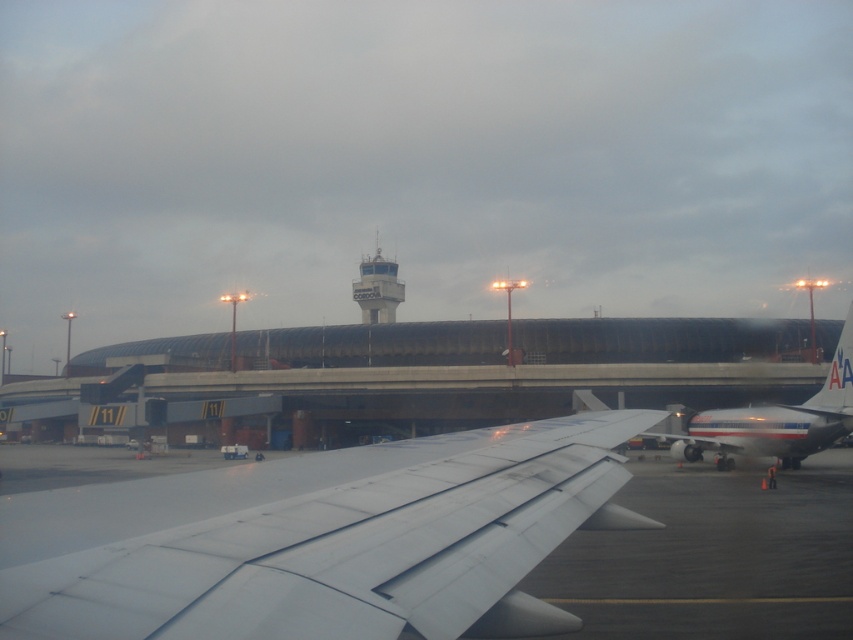
Who is shorter, white matte wing at center or white glossy airplane at right?

white matte wing at center

Is white matte wing at center bigger than white glossy airplane at right?

No, white matte wing at center is not bigger than white glossy airplane at right.

Which is behind, point (457, 570) or point (729, 467)?

The point (729, 467) is behind.

Where is `white matte wing at center`? white matte wing at center is located at coordinates (320, 540).

At what (x,y) coordinates should I click in order to perform the action: click on white glossy airplane at right. Please return your answer as a coordinate pair (x, y). Looking at the image, I should click on (775, 420).

Is point (729, 448) positioned behind point (378, 300)?

No, it is not.

Image resolution: width=853 pixels, height=640 pixels. I want to click on white glossy airplane at right, so click(x=775, y=420).

Who is more forward, (209, 586) or (361, 308)?

Point (209, 586) is more forward.

Does point (264, 532) come farther from viewer compared to point (366, 304)?

No.

At what (x,y) coordinates should I click in order to perform the action: click on white matte wing at center. Please return your answer as a coordinate pair (x, y). Looking at the image, I should click on (320, 540).

Where is `white matte wing at center`? white matte wing at center is located at coordinates (320, 540).